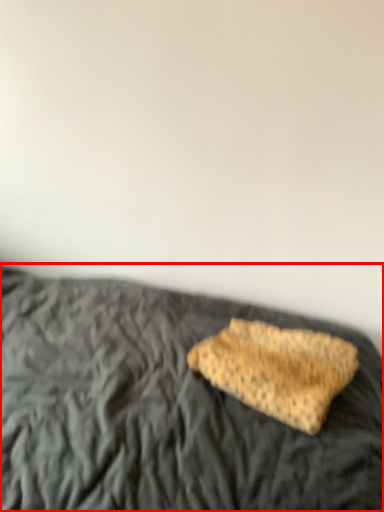
Question: From the image's perspective, where is bed (annotated by the red box) located in relation to sponge in the image?

Choices:
 (A) above
 (B) below

Answer: (B)